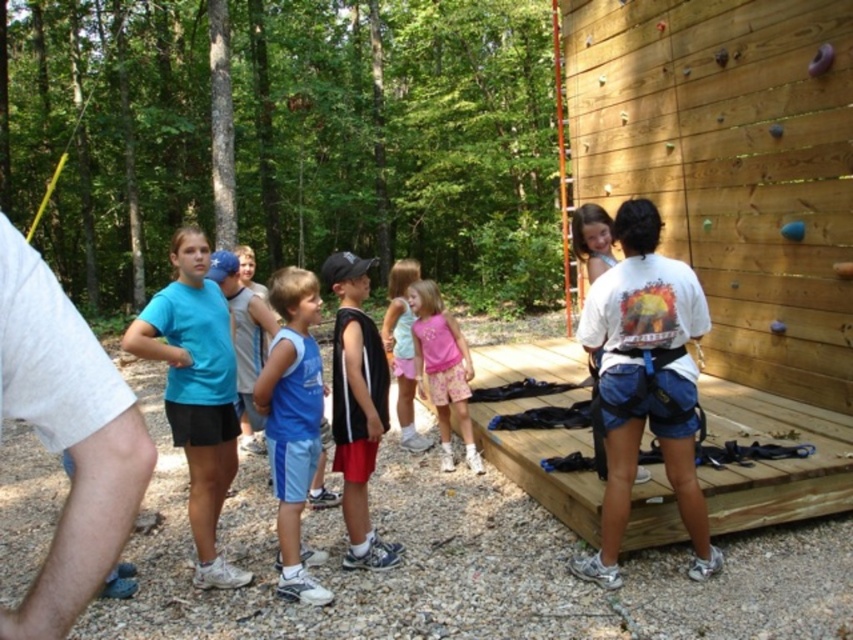
Is white cotton shirt at left further to the viewer compared to matte blue t-shirt at center?

No, white cotton shirt at left is closer to the viewer.

Who is more forward, (x=28, y=289) or (x=207, y=525)?

Positioned in front is point (x=28, y=289).

Identify the location of white cotton shirt at left. (67, 435).

Between matte blue t-shirt at center and blue fabric shorts at center, which one appears on the right side from the viewer's perspective?

blue fabric shorts at center

Between matte blue t-shirt at center and blue fabric shorts at center, which one appears on the left side from the viewer's perspective?

matte blue t-shirt at center

Describe the element at coordinates (196, 392) in the screenshot. I see `matte blue t-shirt at center` at that location.

Identify the location of matte blue t-shirt at center. The width and height of the screenshot is (853, 640). (196, 392).

Who is positioned more to the right, pink cotton shirt at center or pink cotton dress at center?

From the viewer's perspective, pink cotton shirt at center appears more on the right side.

Is point (450, 353) positioned after point (399, 320)?

No, (450, 353) is in front of (399, 320).

Find the location of a particular element. This screenshot has height=640, width=853. pink cotton shirt at center is located at coordinates (442, 369).